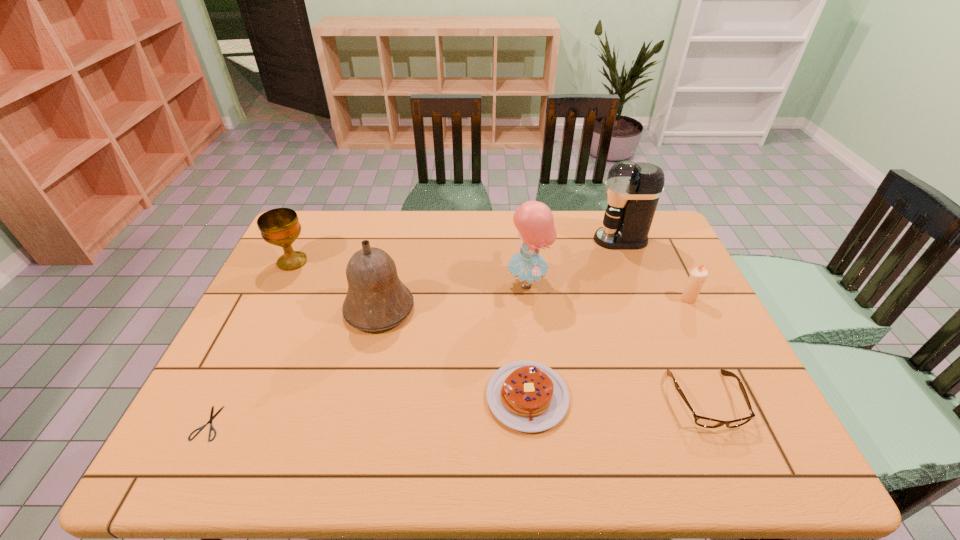
Where is `blank space located 0.340m place cup under the spout of the coffee maker`? This screenshot has width=960, height=540. blank space located 0.340m place cup under the spout of the coffee maker is located at coordinates (493, 240).

Identify the location of free space located place cup under the spout of the coffee maker. (543, 240).

The width and height of the screenshot is (960, 540). Identify the location of vacant space situated on the front-facing side of the doll. (420, 282).

What are the coordinates of `blank space located 0.200m on the front-facing side of the doll` in the screenshot? It's located at (439, 282).

I want to click on free space located on the front-facing side of the doll, so click(x=396, y=282).

I want to click on vacant area located on the left of the sixth object from right to left, so click(274, 309).

This screenshot has height=540, width=960. I want to click on vacant space situated 0.310m on the front of the chalice, so click(x=248, y=353).

Where is `vacant position located 0.270m on the front of the fourth shortest object`? Image resolution: width=960 pixels, height=540 pixels. vacant position located 0.270m on the front of the fourth shortest object is located at coordinates (731, 384).

The height and width of the screenshot is (540, 960). Identify the location of free region located on the back of the pancake. click(519, 307).

In order to click on vacant region located on the right of the shears in this screenshot , I will do `click(391, 423)`.